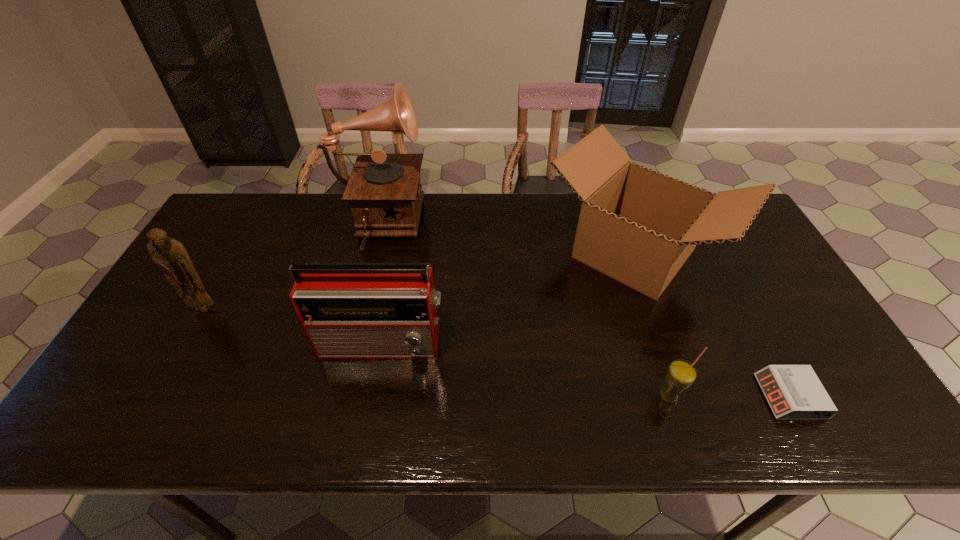
Locate an element on the screen. free space that satisfies the following two spatial constraints: 1. on the front-facing side of the shortest object; 2. on the right side of the figurine is located at coordinates (156, 396).

Find the location of a particular element. The image size is (960, 540). blank space that satisfies the following two spatial constraints: 1. on the horn of the record player; 2. on the back side of the alarm clock is located at coordinates (336, 396).

This screenshot has height=540, width=960. Identify the location of free region that satisfies the following two spatial constraints: 1. on the front-facing side of the straw for drinking; 2. on the left side of the third nearest object. (373, 397).

This screenshot has width=960, height=540. I want to click on blank area in the image that satisfies the following two spatial constraints: 1. on the horn of the box; 2. on the left side of the tallest object, so click(372, 253).

Find the location of a particular element. Image resolution: width=960 pixels, height=540 pixels. vacant space that satisfies the following two spatial constraints: 1. on the front-facing side of the leftmost object; 2. on the left side of the alarm clock is located at coordinates (156, 396).